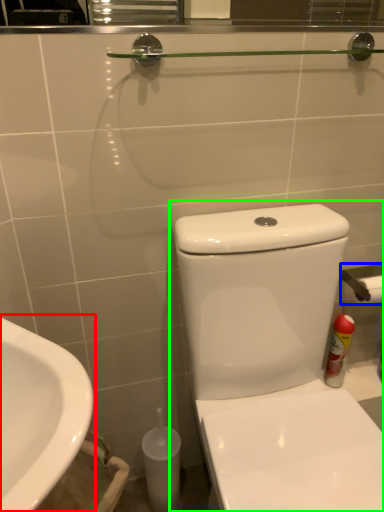
Question: Estimate the real-world distances between objects in this image. Which object is farther from sink (highlighted by a red box), towel bar (highlighted by a blue box) or toilet (highlighted by a green box)?

Choices:
 (A) towel bar
 (B) toilet

Answer: (A)